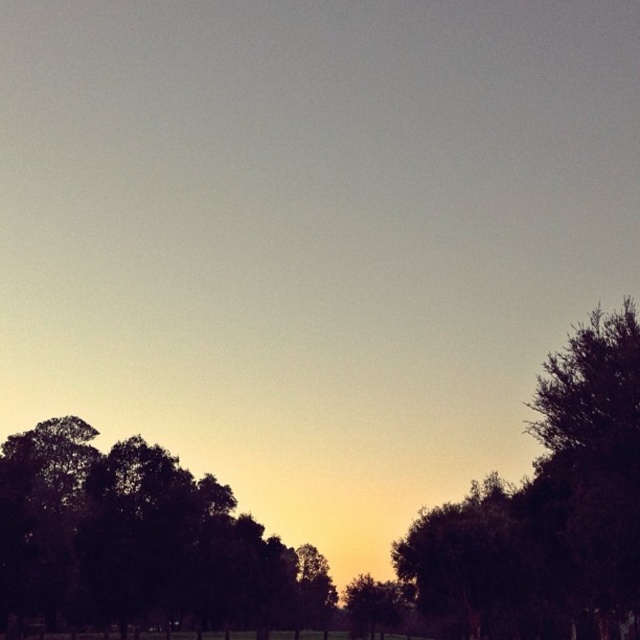
Question: Does dark green leafy tree at left have a smaller size compared to dark green leafy tree at right?

Choices:
 (A) no
 (B) yes

Answer: (A)

Question: Which point is closer to the camera?

Choices:
 (A) dark green leafy tree at left
 (B) green matte tree at center
 (C) dark green leafy tree at right

Answer: (C)

Question: Considering the real-world distances, which object is farthest from the dark green leafy tree at right?

Choices:
 (A) dark green leafy tree at left
 (B) green matte tree at center

Answer: (A)

Question: Considering the real-world distances, which object is farthest from the dark green leafy tree at right?

Choices:
 (A) green matte tree at center
 (B) dark green leafy tree at left

Answer: (B)

Question: Observing the image, what is the correct spatial positioning of dark green leafy tree at right in reference to green matte tree at center?

Choices:
 (A) right
 (B) left

Answer: (A)

Question: Is dark green leafy tree at left below green matte tree at center?

Choices:
 (A) no
 (B) yes

Answer: (A)